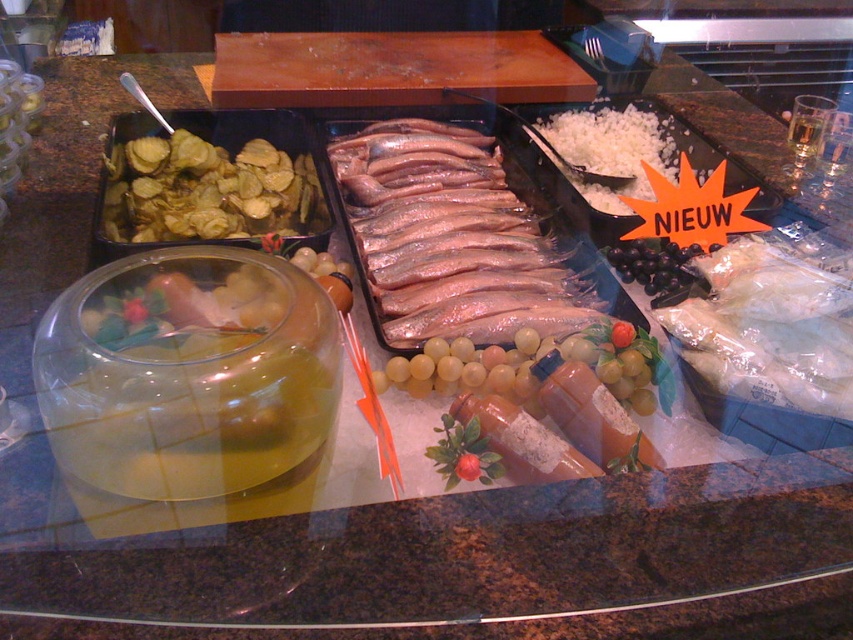
Which is behind, point (747, 305) or point (666, 298)?

The point (666, 298) is more distant.

Is point (764, 268) less distant than point (682, 248)?

That is True.

The image size is (853, 640). What are the coordinates of `white plastic bag at center right` in the screenshot? It's located at (769, 328).

Measure the distance from pinkish-silver fish at center to white crumbly cheese at upper right.

pinkish-silver fish at center is 10.04 inches from white crumbly cheese at upper right.

Based on the photo, who is lower down, pinkish-silver fish at center or white crumbly cheese at upper right?

pinkish-silver fish at center is below.

The width and height of the screenshot is (853, 640). Find the location of `pinkish-silver fish at center`. pinkish-silver fish at center is located at coordinates (448, 237).

The width and height of the screenshot is (853, 640). I want to click on pinkish-silver fish at center, so click(x=448, y=237).

Does white plastic bag at center right appear over green crispy chips at left?

No.

Which of these two, white plastic bag at center right or green crispy chips at left, stands taller?

With more height is green crispy chips at left.

You are a GUI agent. You are given a task and a screenshot of the screen. Output one action in this format:
    pyautogui.click(x=<x>, y=<y>)
    Task: Click on the white plastic bag at center right
    This screenshot has height=640, width=853.
    Given the screenshot: What is the action you would take?
    pyautogui.click(x=769, y=328)

Where is `white plastic bag at center right`? white plastic bag at center right is located at coordinates (769, 328).